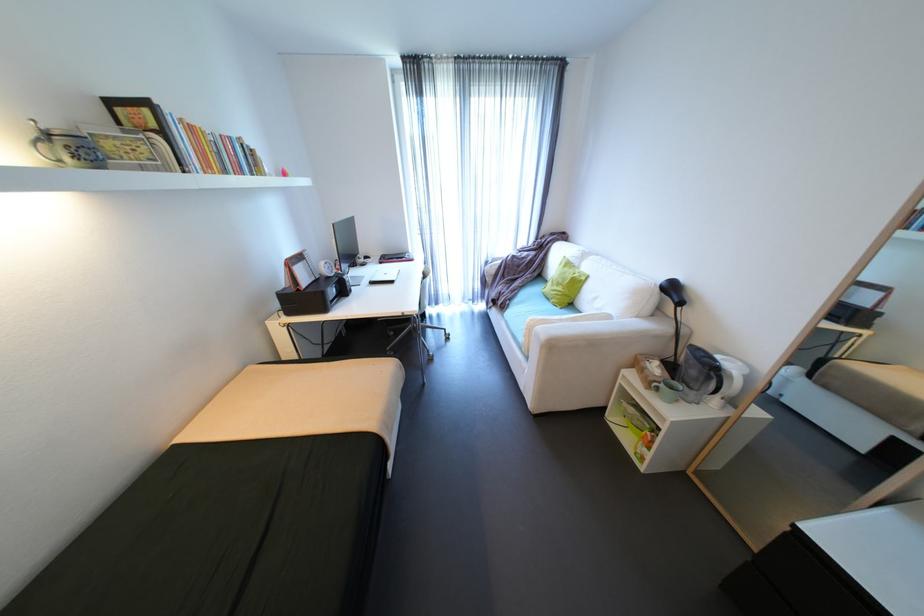
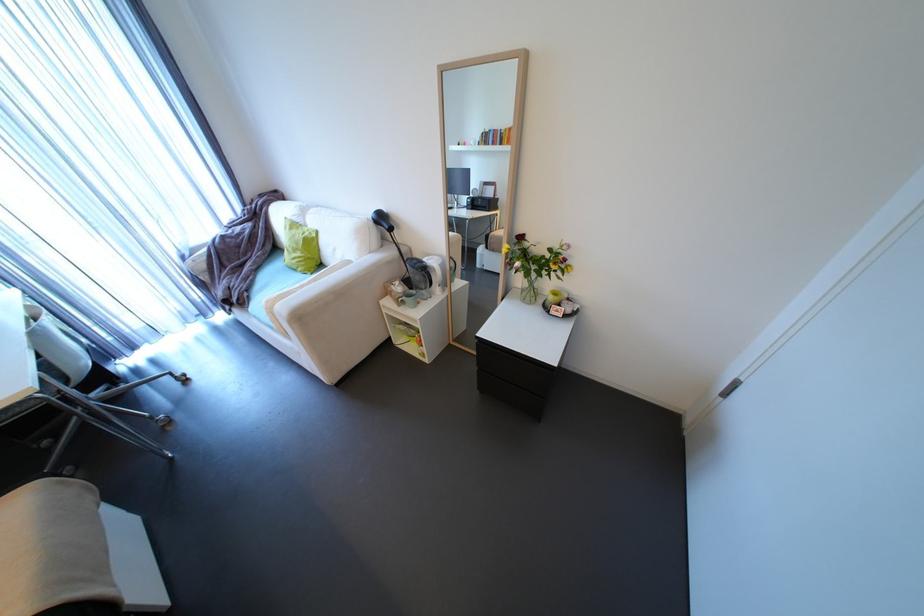
In the second image, find the point that corresponds to point 570,289 in the first image.

(310, 253)